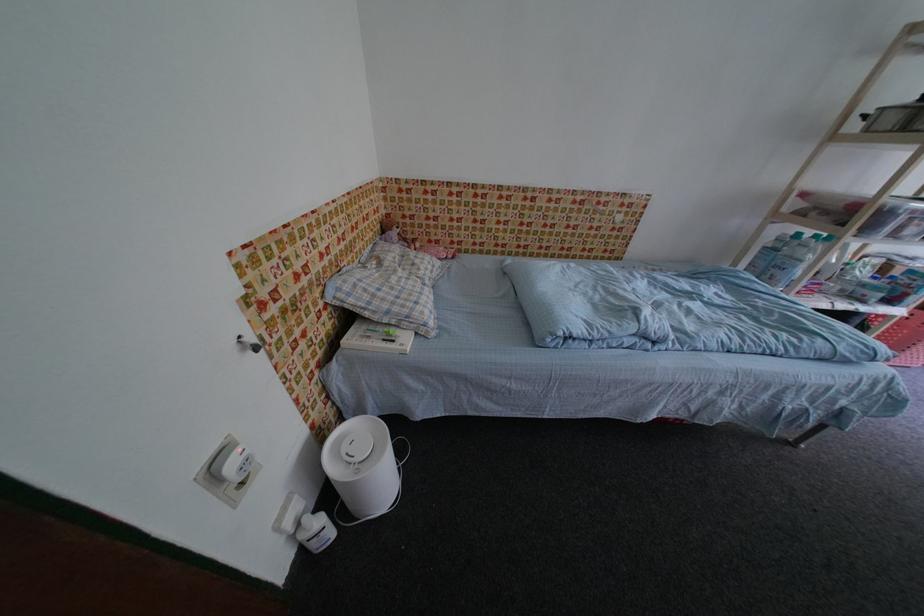
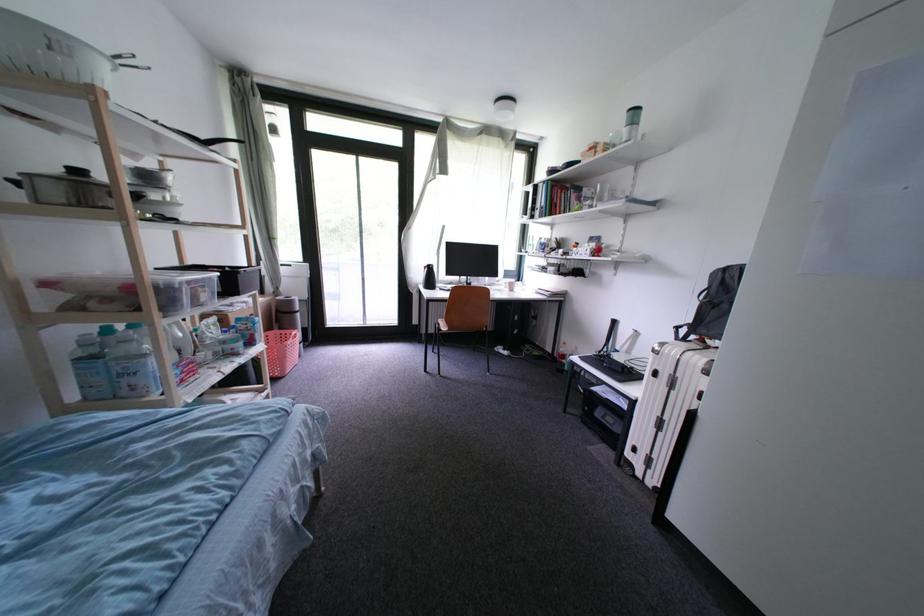
Based on the continuous images, in which direction is the camera rotating?

The rotation direction of the camera is right-down.